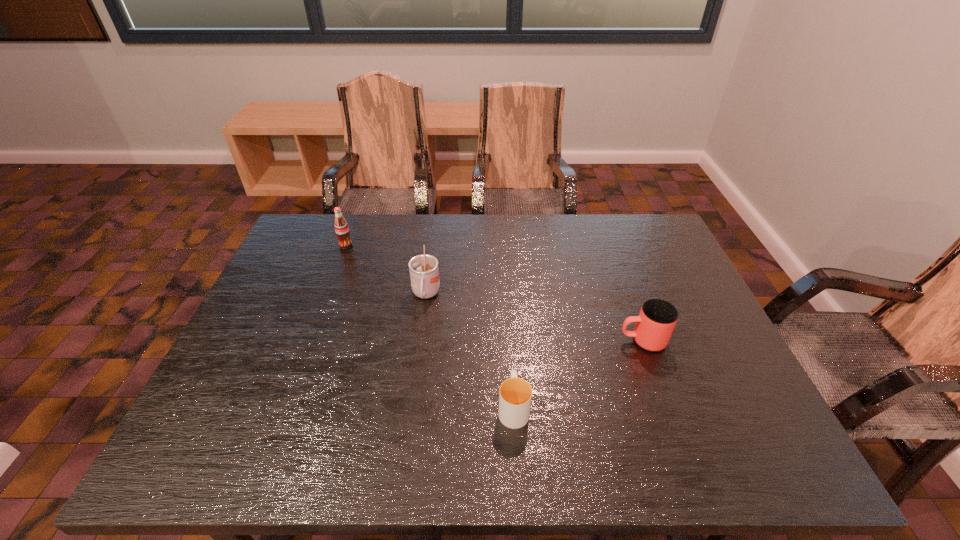
At what (x,y) coordinates should I click in order to perform the action: click on free space between the soda and the second farthest cup. Please return your answer as a coordinate pair (x, y). Looking at the image, I should click on click(494, 293).

What are the coordinates of `vacant area between the leftmost cup and the second object from right to left` in the screenshot? It's located at (469, 351).

At what (x,y) coordinates should I click in order to perform the action: click on free space between the leftmost cup and the third object from left to right. Please return your answer as a coordinate pair (x, y). The width and height of the screenshot is (960, 540). Looking at the image, I should click on (469, 351).

The height and width of the screenshot is (540, 960). Find the location of `free space between the farthest cup and the nearest cup`. free space between the farthest cup and the nearest cup is located at coordinates (469, 351).

Where is `unoccupied position between the rightmost object and the farthest cup`? This screenshot has width=960, height=540. unoccupied position between the rightmost object and the farthest cup is located at coordinates click(534, 318).

The image size is (960, 540). What are the coordinates of `the third closest object to the farthest cup` in the screenshot? It's located at (657, 318).

Identify which object is the nearest to the second nearest cup. Please provide its 2D coordinates. Your answer should be formatted as a tuple, i.e. [(x, y)], where the tuple contains the x and y coordinates of a point satisfying the conditions above.

[(515, 394)]

I want to click on cup that is the closest to the second shortest cup, so click(515, 394).

This screenshot has width=960, height=540. I want to click on the closest cup to the farthest object, so click(424, 274).

Find the location of `vacant space that satisfies the following two spatial constraints: 1. on the handle side of the rightmost object; 2. on the side with the handle of the third object from right to left`. vacant space that satisfies the following two spatial constraints: 1. on the handle side of the rightmost object; 2. on the side with the handle of the third object from right to left is located at coordinates (626, 295).